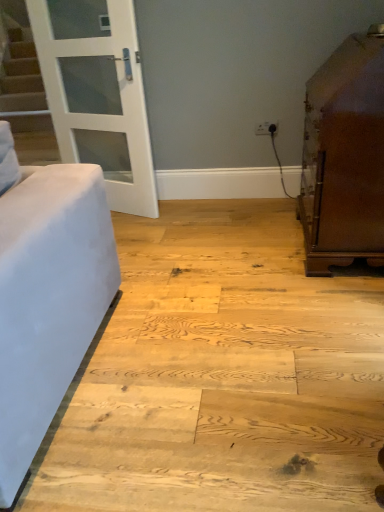
Question: Is there a large distance between white plastic outlet at upper center and brown polished cabinet at right?

Choices:
 (A) yes
 (B) no

Answer: (B)

Question: Is white plastic outlet at upper center directly adjacent to brown polished cabinet at right?

Choices:
 (A) yes
 (B) no

Answer: (B)

Question: Can you confirm if white plastic outlet at upper center is bigger than brown polished cabinet at right?

Choices:
 (A) no
 (B) yes

Answer: (A)

Question: From a real-world perspective, does white plastic outlet at upper center sit lower than brown polished cabinet at right?

Choices:
 (A) no
 (B) yes

Answer: (B)

Question: Does white plastic outlet at upper center lie behind brown polished cabinet at right?

Choices:
 (A) yes
 (B) no

Answer: (A)

Question: Is white plastic outlet at upper center wider or thinner than brown polished cabinet at right?

Choices:
 (A) wide
 (B) thin

Answer: (B)

Question: Is white plastic outlet at upper center in front of or behind brown polished cabinet at right in the image?

Choices:
 (A) behind
 (B) front

Answer: (A)

Question: Is white plastic outlet at upper center bigger or smaller than brown polished cabinet at right?

Choices:
 (A) small
 (B) big

Answer: (A)

Question: Does point (261, 123) appear closer or farther from the camera than point (329, 159)?

Choices:
 (A) closer
 (B) farther

Answer: (B)

Question: From their relative heights in the image, would you say brown polished cabinet at right is taller or shorter than white glass door at upper left?

Choices:
 (A) short
 (B) tall

Answer: (A)

Question: Choose the correct answer: Is brown polished cabinet at right inside white glass door at upper left or outside it?

Choices:
 (A) outside
 (B) inside

Answer: (A)

Question: From a real-world perspective, relative to white glass door at upper left, is brown polished cabinet at right vertically above or below?

Choices:
 (A) below
 (B) above

Answer: (A)

Question: From the image's perspective, relative to white glass door at upper left, is brown polished cabinet at right above or below?

Choices:
 (A) below
 (B) above

Answer: (A)

Question: Considering the positions of brown polished cabinet at right and white plastic outlet at upper center in the image, is brown polished cabinet at right wider or thinner than white plastic outlet at upper center?

Choices:
 (A) thin
 (B) wide

Answer: (B)

Question: Is brown polished cabinet at right in front of or behind white plastic outlet at upper center in the image?

Choices:
 (A) behind
 (B) front

Answer: (B)